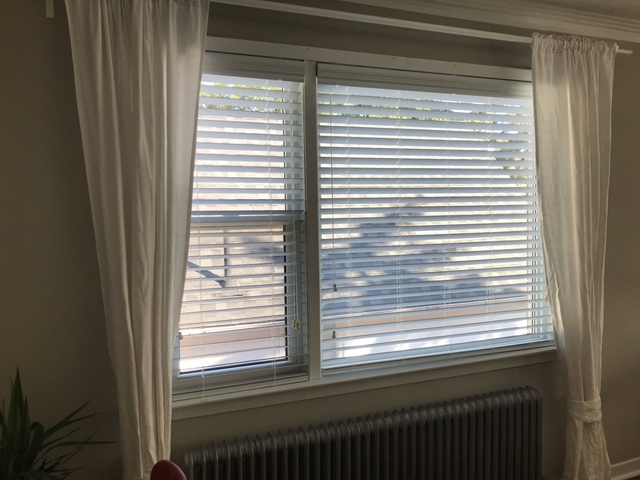
Identify the location of window glass. The width and height of the screenshot is (640, 480). (241, 260), (369, 273), (253, 343), (235, 174).